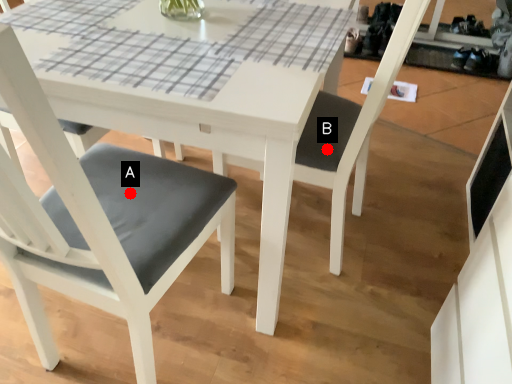
Question: Two points are circled on the image, labeled by A and B beside each circle. Which of the following is the farthest from the observer?

Choices:
 (A) A is further
 (B) B is further

Answer: (B)